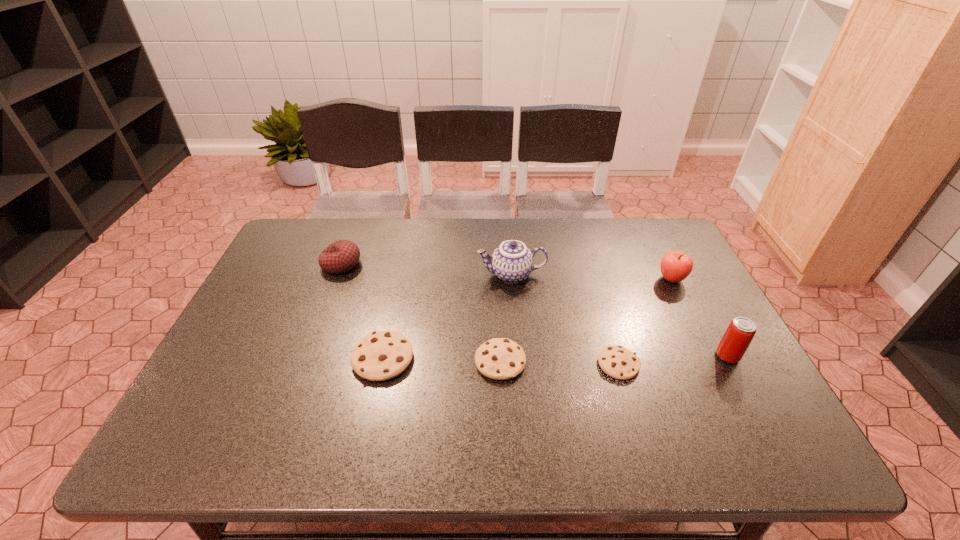
You are a GUI agent. You are given a task and a screenshot of the screen. Output one action in this format:
    pyautogui.click(x=<x>, y=<y>)
    Task: Click on the unoccupied area between the leftmost cookie and the second cookie from left to right
    Image resolution: width=960 pixels, height=540 pixels.
    Given the screenshot: What is the action you would take?
    pyautogui.click(x=442, y=360)

Point out which object is positioned as the second nearest to the apple. Please provide its 2D coordinates. Your answer should be formatted as a tuple, i.e. [(x, y)], where the tuple contains the x and y coordinates of a point satisfying the conditions above.

[(618, 362)]

This screenshot has width=960, height=540. Find the location of `object that can be found as the fourth closest to the beer can`. object that can be found as the fourth closest to the beer can is located at coordinates (499, 358).

You are a GUI agent. You are given a task and a screenshot of the screen. Output one action in this format:
    pyautogui.click(x=<x>, y=<y>)
    Task: Click on the cookie that is the third nearest to the apple
    This screenshot has width=960, height=540.
    Given the screenshot: What is the action you would take?
    pyautogui.click(x=379, y=356)

Choose which cookie is the nearest neighbor to the fifth tallest object. Please provide its 2D coordinates. Your answer should be formatted as a tuple, i.e. [(x, y)], where the tuple contains the x and y coordinates of a point satisfying the conditions above.

[(499, 358)]

Identify the location of vacant point that satisfies the following two spatial constraints: 1. on the front side of the second shortest object; 2. on the right side of the fifth tallest object. (383, 361).

Where is `vacant space that satisfies the following two spatial constraints: 1. from the spout of the chinaware; 2. on the left side of the shortest cookie`? The width and height of the screenshot is (960, 540). vacant space that satisfies the following two spatial constraints: 1. from the spout of the chinaware; 2. on the left side of the shortest cookie is located at coordinates (519, 364).

Image resolution: width=960 pixels, height=540 pixels. I want to click on vacant position in the image that satisfies the following two spatial constraints: 1. on the front side of the leftmost object; 2. on the left side of the beer can, so click(307, 356).

Identify the location of free space that satisfies the following two spatial constraints: 1. on the back side of the beer can; 2. on the right side of the second cookie from left to right. (500, 356).